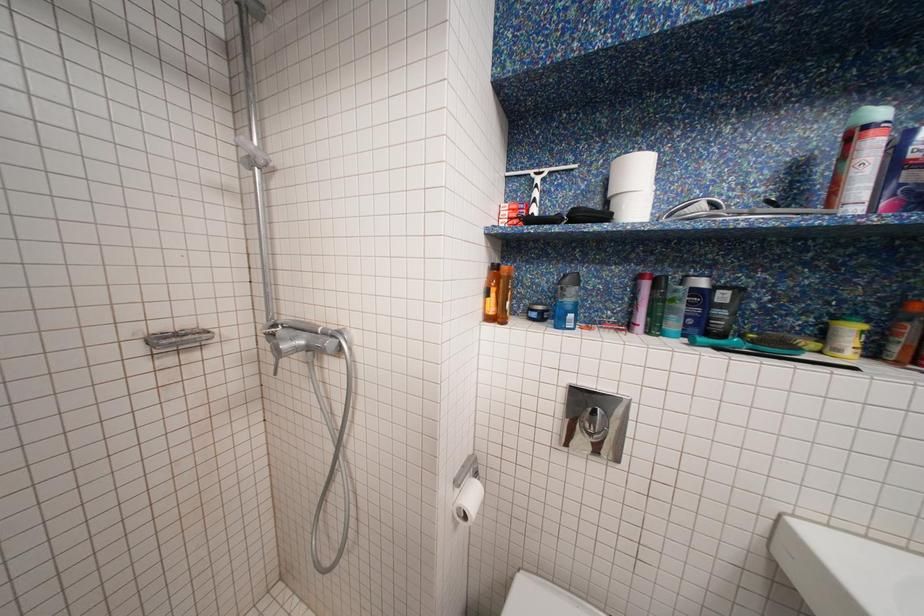
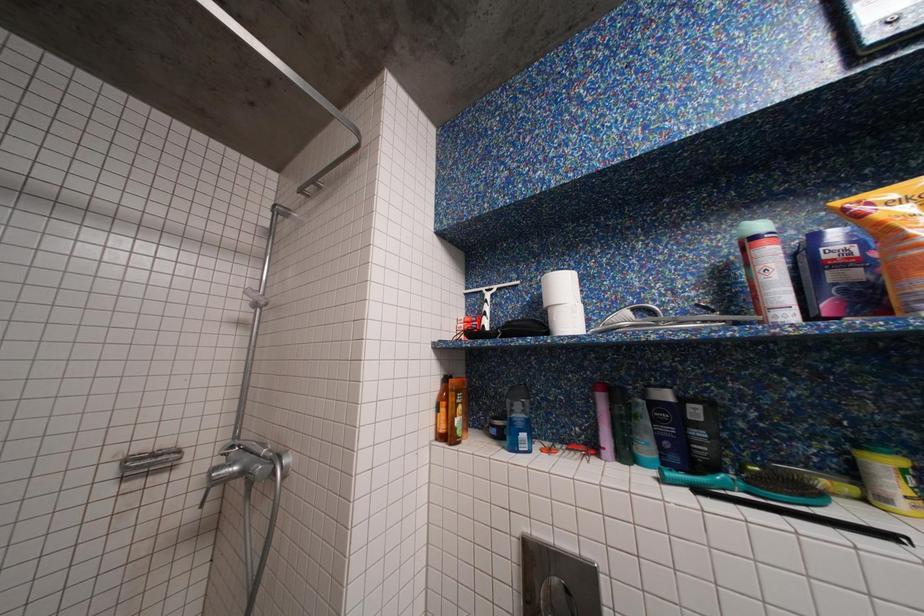
Question: Based on the continuous images, in which direction is the camera rotating? Reply with the corresponding letter.

Choices:
 (A) Left
 (B) Right
 (C) Up
 (D) Down

Answer: (C)